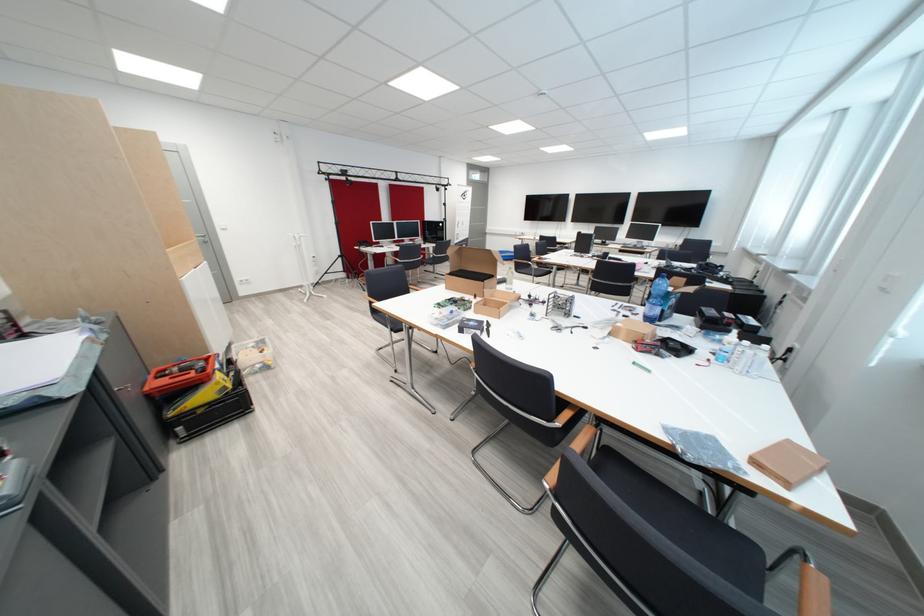
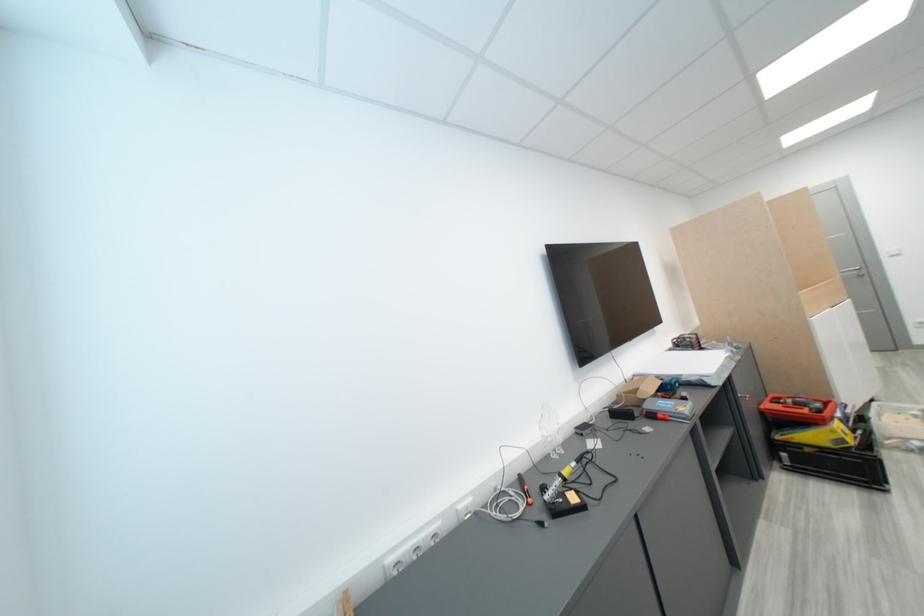
Question: The first image is from the beginning of the video and the second image is from the end. How did the camera likely rotate when shooting the video?

Choices:
 (A) Left
 (B) Right
 (C) Up
 (D) Down

Answer: (A)